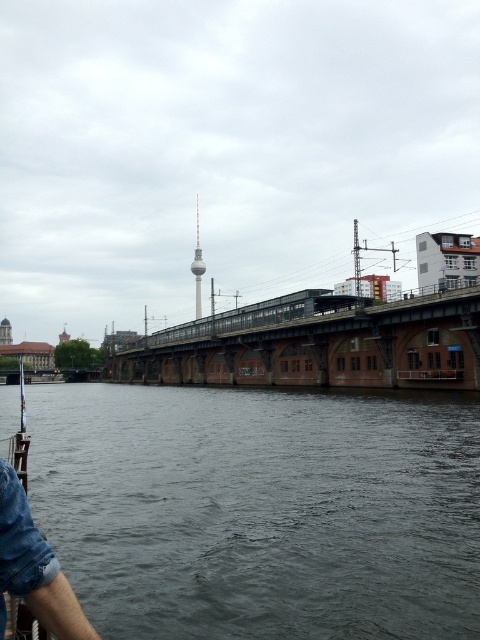
Who is higher up, dark gray water at lower center or denim shorts at lower left?

denim shorts at lower left is higher up.

Measure the distance between point (191,508) and camera.

54.29 meters

You are a GUI agent. You are given a task and a screenshot of the screen. Output one action in this format:
    pyautogui.click(x=<x>, y=<y>)
    Task: Click on the dark gray water at lower center
    This screenshot has height=640, width=480.
    Given the screenshot: What is the action you would take?
    pyautogui.click(x=261, y=509)

Who is taller, brown brick bridge at center or denim shorts at lower left?

brown brick bridge at center

Is brown brick bridge at center below denim shorts at lower left?

No.

Find the location of a particular element. brown brick bridge at center is located at coordinates (317, 344).

The height and width of the screenshot is (640, 480). Find the location of `brown brick bridge at center`. brown brick bridge at center is located at coordinates (317, 344).

Does dark gray water at lower center have a lesser height compared to brown brick bridge at center?

Yes.

Identify the location of dark gray water at lower center. The width and height of the screenshot is (480, 640). (261, 509).